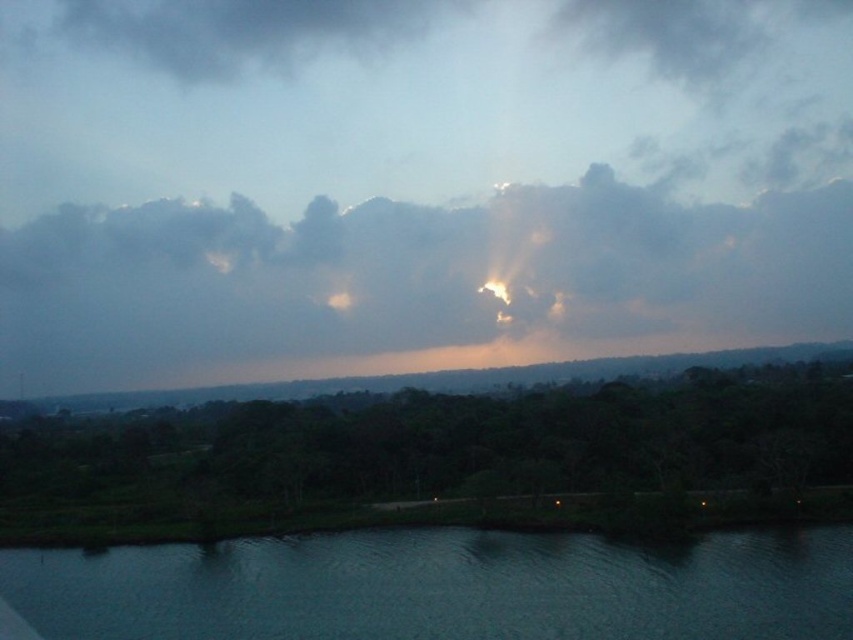
Which is more to the right, smokey gray cloud at upper center or dark blue water at lower center?

From the viewer's perspective, smokey gray cloud at upper center appears more on the right side.

Does smokey gray cloud at upper center appear under dark blue water at lower center?

Actually, smokey gray cloud at upper center is above dark blue water at lower center.

Between point (706, 216) and point (68, 568), which one is positioned in front?

Point (68, 568) is more forward.

Find the location of `smokey gray cloud at upper center`. smokey gray cloud at upper center is located at coordinates (412, 284).